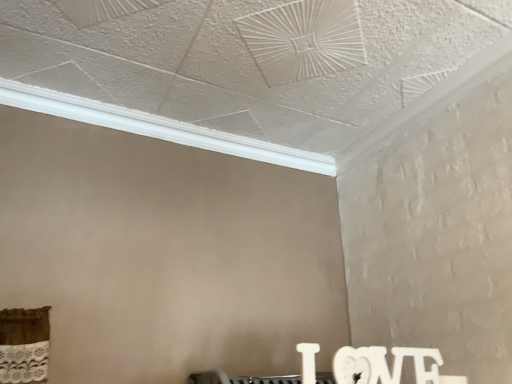
Question: Is white textured crown molding at upper center positioned with its back to white matte wooden letters at lower right?

Choices:
 (A) no
 (B) yes

Answer: (A)

Question: Does white textured crown molding at upper center come behind white matte wooden letters at lower right?

Choices:
 (A) no
 (B) yes

Answer: (B)

Question: Is white textured crown molding at upper center positioned before white matte wooden letters at lower right?

Choices:
 (A) no
 (B) yes

Answer: (A)

Question: Considering the relative sizes of white textured crown molding at upper center and white matte wooden letters at lower right in the image provided, is white textured crown molding at upper center bigger than white matte wooden letters at lower right?

Choices:
 (A) yes
 (B) no

Answer: (A)

Question: From a real-world perspective, is white textured crown molding at upper center positioned under white matte wooden letters at lower right based on gravity?

Choices:
 (A) yes
 (B) no

Answer: (B)

Question: From the image's perspective, is white textured crown molding at upper center located beneath white matte wooden letters at lower right?

Choices:
 (A) no
 (B) yes

Answer: (A)

Question: Does white matte wooden letters at lower right appear on the right side of white textured crown molding at upper center?

Choices:
 (A) yes
 (B) no

Answer: (A)

Question: Can you confirm if white matte wooden letters at lower right is bigger than white textured crown molding at upper center?

Choices:
 (A) no
 (B) yes

Answer: (A)

Question: Does white matte wooden letters at lower right have a smaller size compared to white textured crown molding at upper center?

Choices:
 (A) yes
 (B) no

Answer: (A)

Question: From a real-world perspective, is white matte wooden letters at lower right beneath white textured crown molding at upper center?

Choices:
 (A) yes
 (B) no

Answer: (A)

Question: Is white matte wooden letters at lower right aimed at white textured crown molding at upper center?

Choices:
 (A) yes
 (B) no

Answer: (B)

Question: Considering the relative positions of white matte wooden letters at lower right and white textured crown molding at upper center in the image provided, is white matte wooden letters at lower right to the left of white textured crown molding at upper center from the viewer's perspective?

Choices:
 (A) no
 (B) yes

Answer: (A)

Question: Considering the positions of white textured crown molding at upper center and white matte wooden letters at lower right in the image, is white textured crown molding at upper center wider or thinner than white matte wooden letters at lower right?

Choices:
 (A) wide
 (B) thin

Answer: (A)